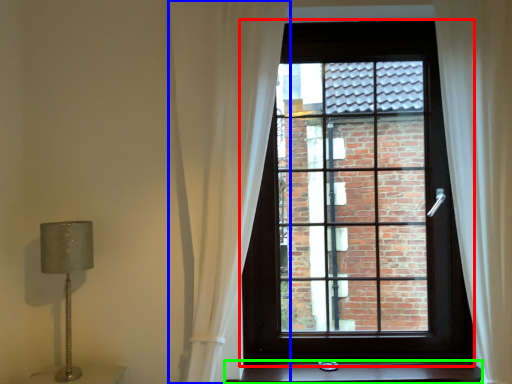
Question: Which object is positioned closest to window (highlighted by a red box)? Select from curtain (highlighted by a blue box) and stairs (highlighted by a green box).

Choices:
 (A) curtain
 (B) stairs

Answer: (A)